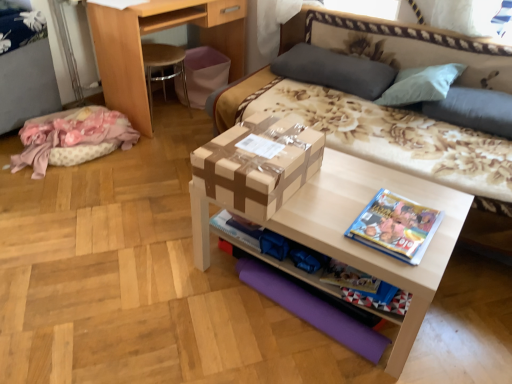
Identify the location of vacant area to the right of pink fabric at left. (148, 163).